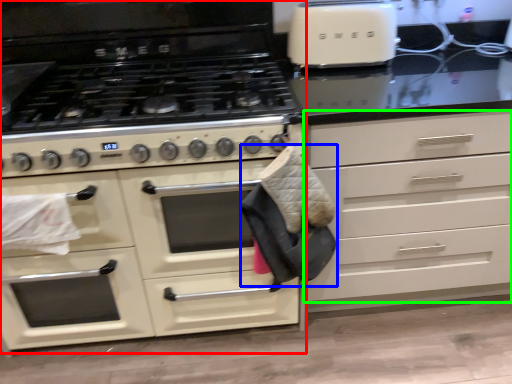
Question: Estimate the real-world distances between objects in this image. Which object is farther from cabinetry (highlighted by a red box), material (highlighted by a blue box) or drawer (highlighted by a green box)?

Choices:
 (A) material
 (B) drawer

Answer: (B)